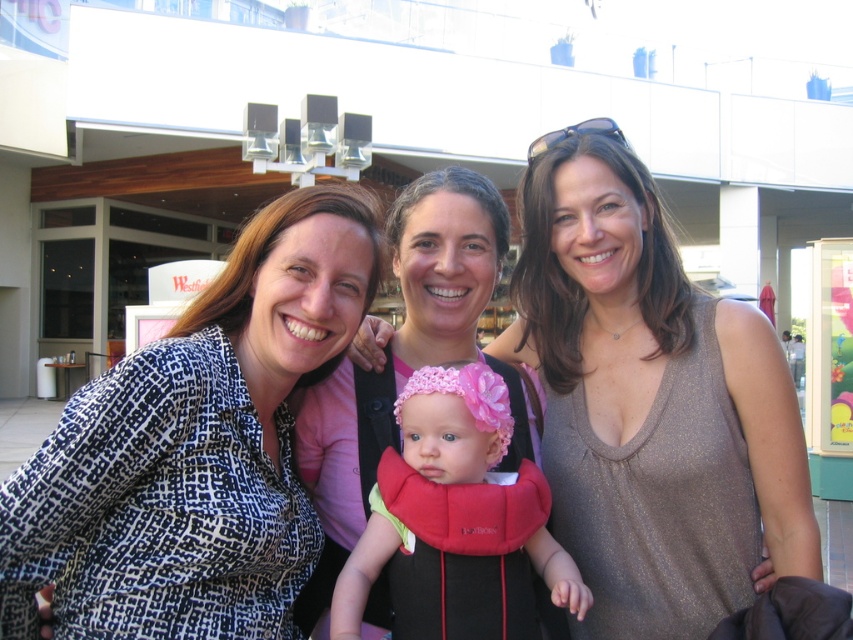
Is shiny gold tank top at center further to the viewer compared to pink knitted hat at center?

Yes, shiny gold tank top at center is behind pink knitted hat at center.

Is shiny gold tank top at center taller than pink knitted hat at center?

Yes.

Image resolution: width=853 pixels, height=640 pixels. Identify the location of shiny gold tank top at center. (650, 403).

Does printed fabric shirt at center have a lesser width compared to pink fabric baby carrier at center?

Incorrect, printed fabric shirt at center's width is not less than pink fabric baby carrier at center's.

Who is more forward, [257,323] or [466,214]?

Point [257,323]

The height and width of the screenshot is (640, 853). Find the location of `printed fabric shirt at center`. printed fabric shirt at center is located at coordinates (196, 448).

Does printed fabric shirt at center come behind pink knitted hat at center?

No.

Between point (45, 483) and point (469, 518), which one is positioned behind?

The point (469, 518) is more distant.

Find the location of `printed fabric shirt at center`. printed fabric shirt at center is located at coordinates (196, 448).